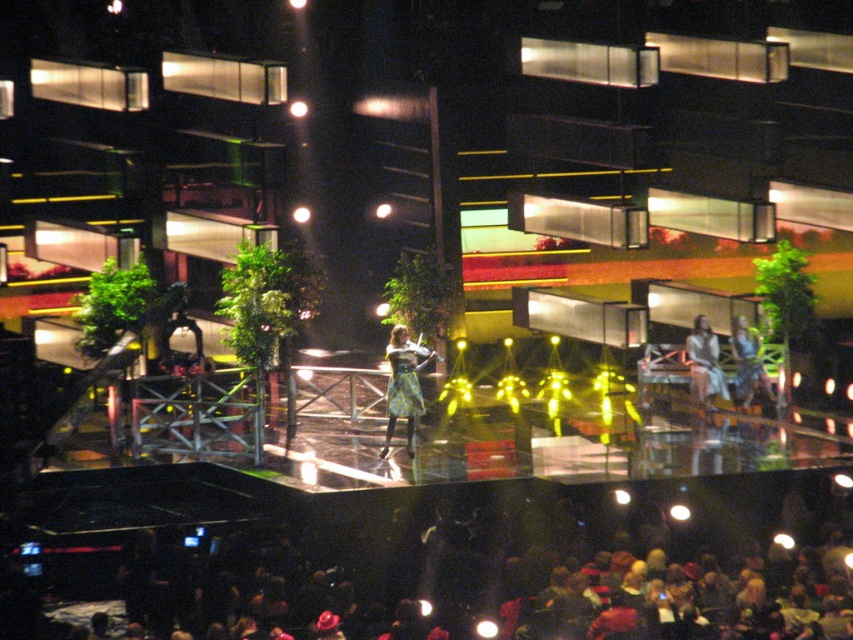
Can you confirm if floral-patterned dress at center is positioned to the left of floral dress at center?

Indeed, floral-patterned dress at center is positioned on the left side of floral dress at center.

Does floral-patterned dress at center appear under floral dress at center?

Indeed, floral-patterned dress at center is positioned under floral dress at center.

Who is more forward, (395, 381) or (741, 344)?

Point (395, 381)

Locate an element on the screen. The width and height of the screenshot is (853, 640). floral-patterned dress at center is located at coordinates click(403, 385).

Is dark fabric crowd at lower center positioned in front of light brown leather jacket at center?

Yes, dark fabric crowd at lower center is in front of light brown leather jacket at center.

Which is in front, point (256, 515) or point (715, 362)?

Point (256, 515)

This screenshot has width=853, height=640. I want to click on dark fabric crowd at lower center, so click(x=457, y=568).

Between dark fabric crowd at lower center and floral dress at center, which one is positioned higher?

floral dress at center is higher up.

Is dark fabric crowd at lower center shorter than floral dress at center?

Correct, dark fabric crowd at lower center is not as tall as floral dress at center.

Which is in front, point (807, 616) or point (750, 380)?

Point (807, 616) is more forward.

This screenshot has width=853, height=640. I want to click on dark fabric crowd at lower center, so pyautogui.click(x=457, y=568).